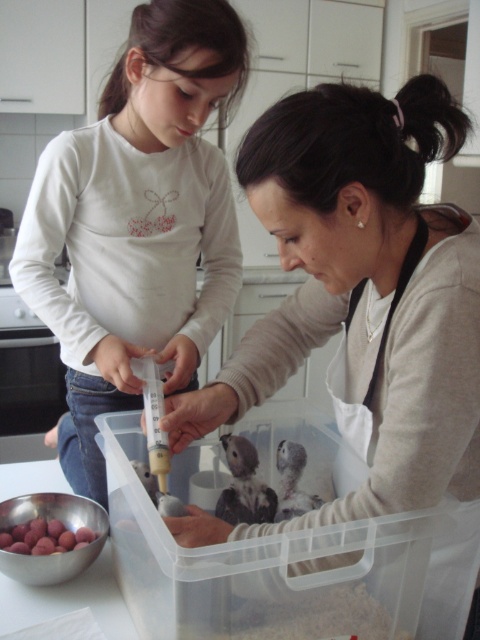
You are a chef preparing a meal and need to place the matte white apron at center and the smooth metallic bowl at lower left on a shelf. The shelf has a height limit of 1 meter. Can both items fit vertically on the shelf without exceeding the height limit?

The matte white apron at center is much taller than the smooth metallic bowl at lower left. Since the apron is taller, it might exceed the 1 meter height limit. Therefore, only the smooth metallic bowl at lower left can fit vertically on the shelf without exceeding the height limit.

You are a photographer trying to capture a closeup of the fluffy gray bird at center. However, the matte white apron at center is blocking your view. Can you determine if the apron is in front of or behind the bird?

The matte white apron at center is positioned over fluffy gray bird at center, meaning the apron is in front of the bird, blocking the view.

You are a photographer setting up a shot in the kitchen. You need to decide whether to place a narrow accessory next to the matte white shirt at upper left or the smooth metallic bowl at lower left. Which object has more space to accommodate the accessory without overlapping?

The matte white shirt at upper left might be wider than smooth metallic bowl at lower left, so placing the narrow accessory next to the matte white shirt at upper left would provide more space to avoid overlapping.